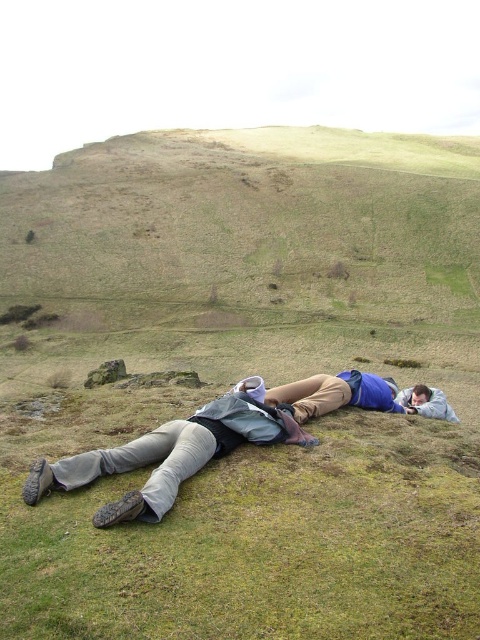
You are standing at the viewpoint of the image and want to reach point (60, 474). Is the distance less than 20 feet?

The distance between the viewer and point (60, 474) is 17.03 feet, which is less than 20 feet.

Looking at this image, you are a photographer trying to capture a landscape photo of the khaki pants at center and the light gray fabric at lower right. Which object should you zoom in on to ensure both are fully visible in the frame?

The khaki pants at center has a lesser width compared to light gray fabric at lower right, so you should zoom in on the light gray fabric at lower right to ensure both are fully visible in the frame.

You are standing on the grassy hillside and want to place a small picnic basket between the khaki pants at center and the light gray fabric at lower right. Based on their positions, where should you place the basket so it is between them?

Place the picnic basket between the khaki pants at center and the light gray fabric at lower right by positioning it in front of the light gray fabric at lower right, since the khaki pants at center is already in front of it.